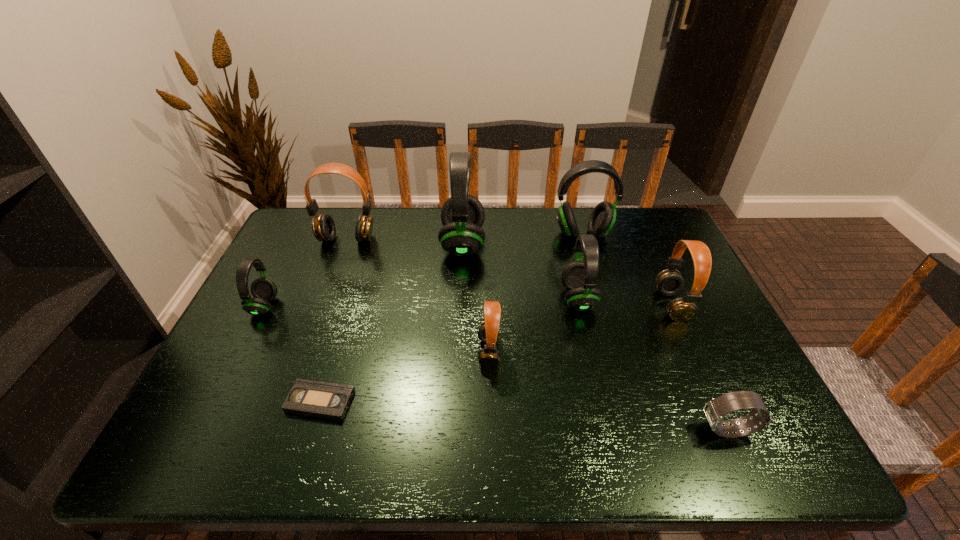
Where is `free space located on the ear cups of the second smallest black headset`? The width and height of the screenshot is (960, 540). free space located on the ear cups of the second smallest black headset is located at coordinates (533, 299).

I want to click on free location located on the ear cups of the second smallest black headset, so click(476, 299).

Where is `vacant space positioned on the ear cups of the second smallest black headset`? This screenshot has height=540, width=960. vacant space positioned on the ear cups of the second smallest black headset is located at coordinates (543, 299).

Locate an element on the screen. This screenshot has width=960, height=540. free spot located on the ear cups of the third nearest object is located at coordinates (434, 352).

The width and height of the screenshot is (960, 540). In order to click on free space located on the ear cups of the third nearest object in this screenshot , I will do `click(362, 352)`.

The width and height of the screenshot is (960, 540). I want to click on vacant space situated 0.070m on the ear cups of the third nearest object, so click(449, 352).

The height and width of the screenshot is (540, 960). What are the coordinates of `vacant space positioned on the ear cups of the leftmost object` in the screenshot? It's located at (331, 306).

Where is `vacant space located on the face of the eighth tallest object`? vacant space located on the face of the eighth tallest object is located at coordinates (649, 430).

Identify the location of free space located 0.380m on the face of the eighth tallest object. The height and width of the screenshot is (540, 960). coord(523,430).

This screenshot has height=540, width=960. I want to click on vacant position located on the face of the eighth tallest object, so click(x=644, y=430).